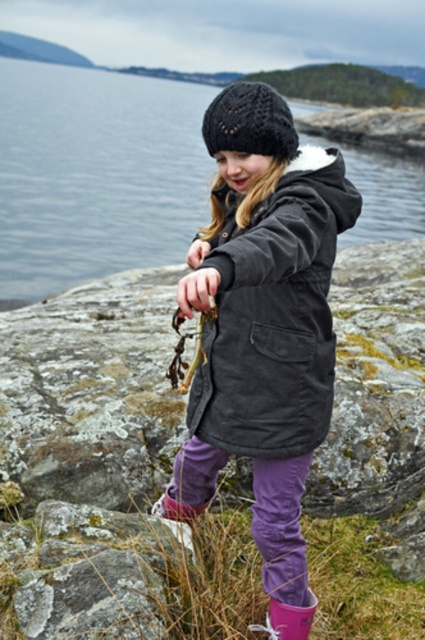
Does matte black coat at center appear on the right side of dark gray corduroy jacket at center?

No, matte black coat at center is not to the right of dark gray corduroy jacket at center.

Between point (308, 342) and point (325, 372), which one is positioned in front?

Positioned in front is point (308, 342).

Which is in front, point (283, 394) or point (235, 445)?

Point (283, 394) is in front.

Locate an element on the screen. matte black coat at center is located at coordinates (261, 323).

Can you confirm if dark gray corduroy jacket at center is positioned to the left of gray rough rock at lower left?

No, dark gray corduroy jacket at center is not to the left of gray rough rock at lower left.

Which is more to the left, dark gray corduroy jacket at center or gray rough rock at lower left?

Positioned to the left is gray rough rock at lower left.

Which is behind, point (317, 150) or point (53, 595)?

Positioned behind is point (53, 595).

Where is `dark gray corduroy jacket at center`? This screenshot has height=640, width=425. dark gray corduroy jacket at center is located at coordinates click(274, 314).

Who is higher up, matte black coat at center or black knitted hat at center?

Positioned higher is black knitted hat at center.

Does matte black coat at center have a greater width compared to black knitted hat at center?

Yes, matte black coat at center is wider than black knitted hat at center.

Between point (212, 419) and point (243, 90), which one is positioned behind?

Positioned behind is point (212, 419).

At what (x,y) coordinates should I click in order to perform the action: click on matte black coat at center. Please return your answer as a coordinate pair (x, y). Looking at the image, I should click on (261, 323).